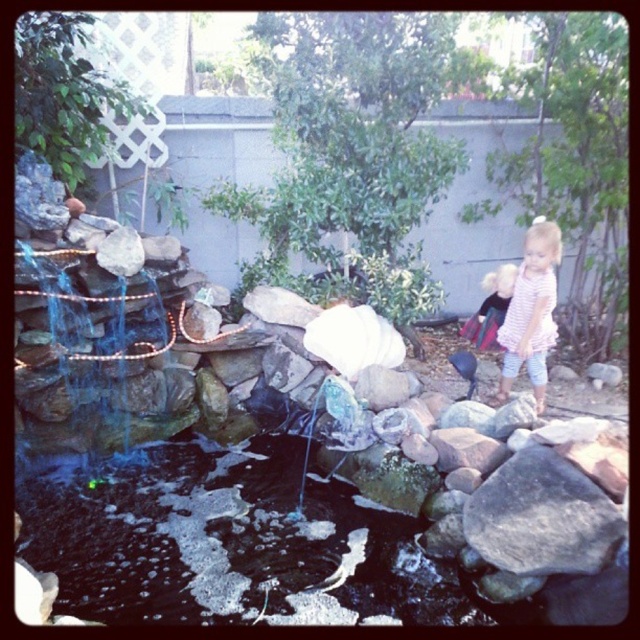
You are standing in the backyard and want to place a pink cotton dress at center on the gray rough rock at lower right. Is the rock a suitable base for the dress?

The gray rough rock at lower right is below the pink cotton dress at center, so the dress is already positioned above the rock. However, the description does not provide information about the rock stability or surface texture, so it is unclear if it can support the dress properly.

You are a photographer setting up a shot of the blonde hair child at right and the white matte rock at center. To ensure both subjects are in focus, you need to know their relative sizes. Which object is taller?

The blonde hair child at right is taller than the white matte rock at center.